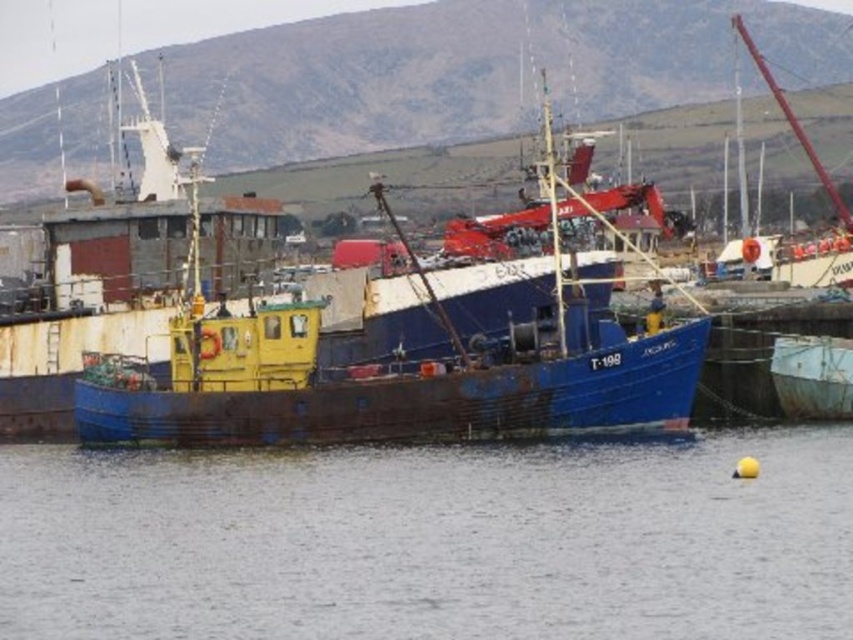
You are standing on the pier and want to take a photo of the transparent water at center and the rusty metal boat at lower right. Which object will appear larger in your photo?

The transparent water at center will appear larger in your photo because it is closer to the viewer than the rusty metal boat at lower right, making it appear bigger due to perspective.

You are a small toy boat that is 1 meter long. You want to sail from the transparent water at center to the rusty metal boat at lower right. Can you fit through the space between them?

The transparent water at center might be wider than rusty metal boat at lower right, so the space between them may be sufficient for the toy boat to pass through.